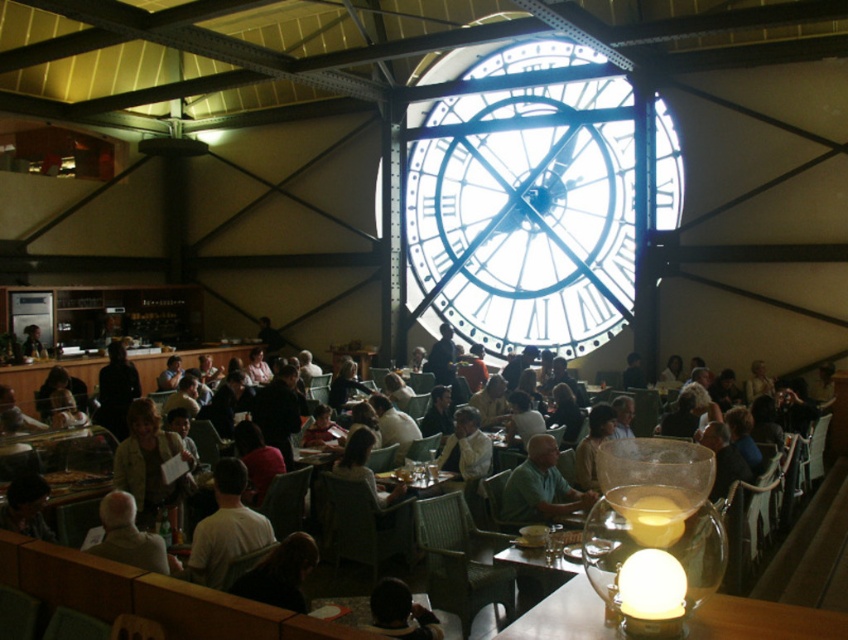
Does transparent glass clock at center appear over light brown leather jacket at center?

Yes, transparent glass clock at center is above light brown leather jacket at center.

Can you confirm if transparent glass clock at center is bigger than light brown leather jacket at center?

Indeed, transparent glass clock at center has a larger size compared to light brown leather jacket at center.

At what (x,y) coordinates should I click in order to perform the action: click on transparent glass clock at center. Please return your answer as a coordinate pair (x, y). Looking at the image, I should click on (525, 212).

In order to click on transparent glass clock at center in this screenshot , I will do `click(525, 212)`.

Is point (395, 586) farther from camera compared to point (422, 464)?

No, (395, 586) is in front of (422, 464).

The width and height of the screenshot is (848, 640). I want to click on dark gray sweater at lower center, so click(x=400, y=612).

This screenshot has height=640, width=848. In order to click on dark gray sweater at lower center in this screenshot , I will do tap(400, 612).

Is light beige shirt at lower left to the right of dark gray sweater at lower center from the viewer's perspective?

In fact, light beige shirt at lower left is to the left of dark gray sweater at lower center.

Consider the image. Who is taller, light beige shirt at lower left or dark gray sweater at lower center?

light beige shirt at lower left is taller.

What do you see at coordinates (127, 536) in the screenshot? I see `light beige shirt at lower left` at bounding box center [127, 536].

Locate an element on the screen. Image resolution: width=848 pixels, height=640 pixels. light beige shirt at lower left is located at coordinates (127, 536).